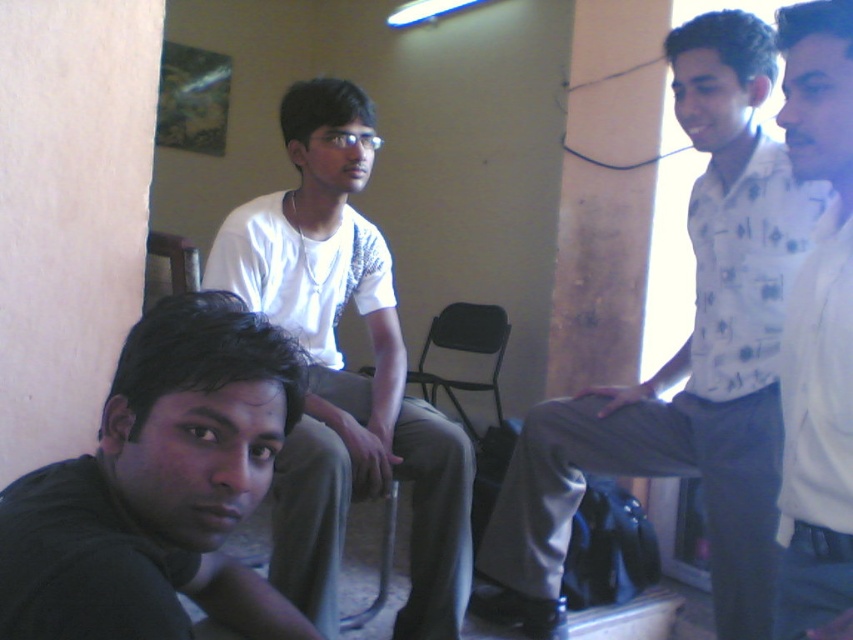
Measure the distance between white matte shirt at upper right and camera.

They are 38.69 inches apart.

Does point (834, 472) lie in front of point (146, 269)?

Yes, it is.

Identify the location of white matte shirt at upper right. (817, 332).

Is white matte shirt at upper right thinner than black metal chair at center?

Correct, white matte shirt at upper right's width is less than black metal chair at center's.

The height and width of the screenshot is (640, 853). What do you see at coordinates (817, 332) in the screenshot?
I see `white matte shirt at upper right` at bounding box center [817, 332].

You are a GUI agent. You are given a task and a screenshot of the screen. Output one action in this format:
    pyautogui.click(x=<x>, y=<y>)
    Task: Click on the white matte shirt at upper right
    Image resolution: width=853 pixels, height=640 pixels.
    Given the screenshot: What is the action you would take?
    pyautogui.click(x=817, y=332)

Is black metal chair at center bigger than metallic gray chair at upper left?

Yes, black metal chair at center is bigger than metallic gray chair at upper left.

At what (x,y) coordinates should I click in order to perform the action: click on black metal chair at center. Please return your answer as a coordinate pair (x, y). Looking at the image, I should click on (463, 352).